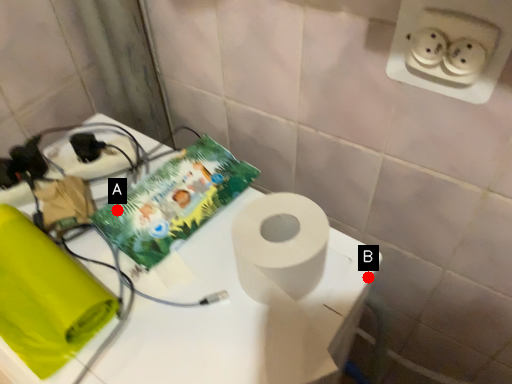
Question: Two points are circled on the image, labeled by A and B beside each circle. Which point appears closest to the camera in this image?

Choices:
 (A) A is closer
 (B) B is closer

Answer: (B)